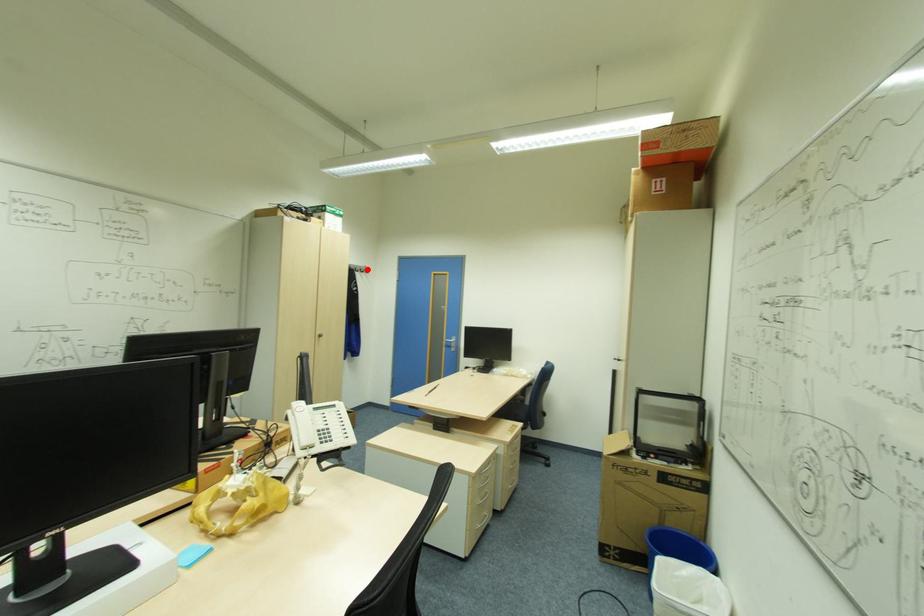
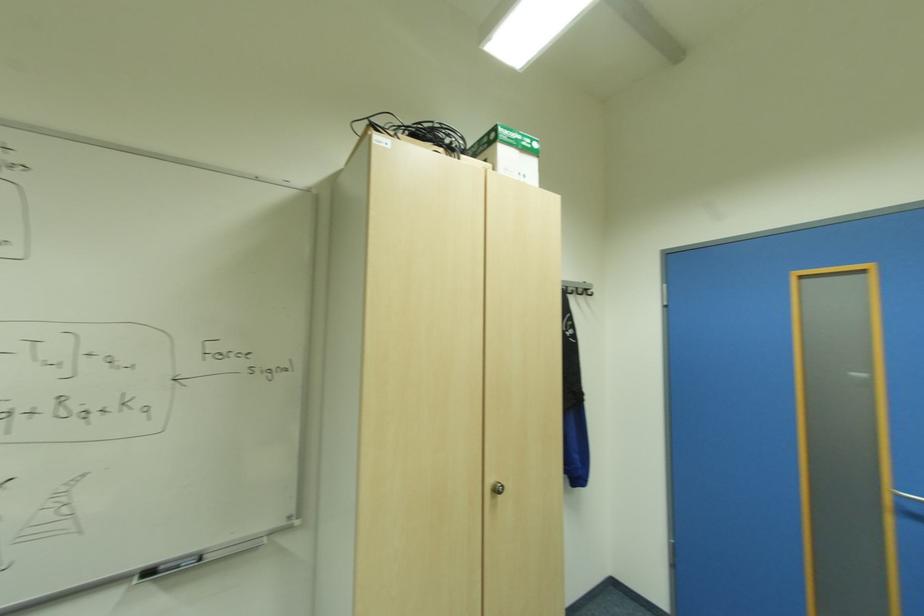
The point at the highlighted location is marked in the first image. Where is the corresponding point in the second image?

(588, 291)